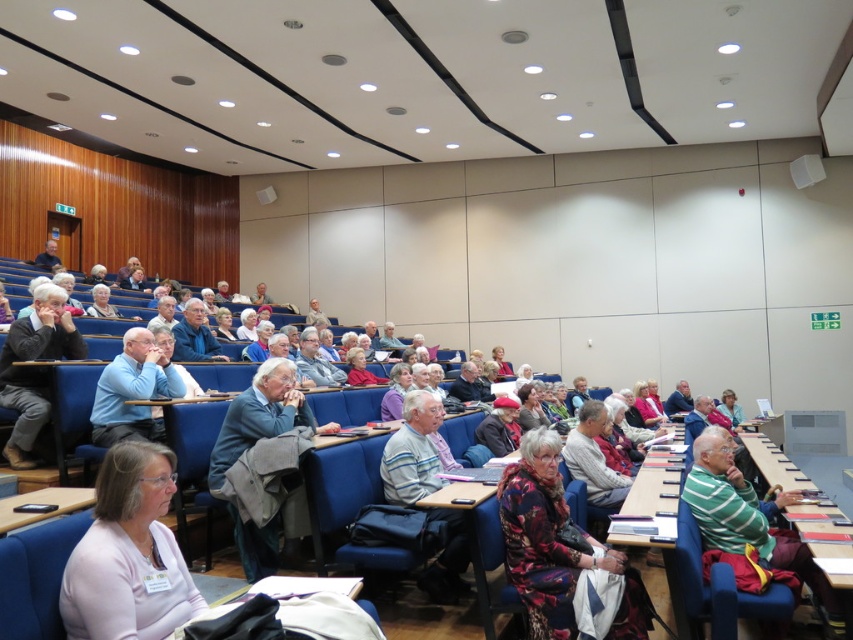
Image resolution: width=853 pixels, height=640 pixels. What do you see at coordinates (194, 337) in the screenshot?
I see `gray fabric jacket at center` at bounding box center [194, 337].

Between gray fabric jacket at center and matte black jacket at center, which one has more height?

With more height is gray fabric jacket at center.

Where is `gray fabric jacket at center`? Image resolution: width=853 pixels, height=640 pixels. gray fabric jacket at center is located at coordinates (194, 337).

Does floral fabric dress at center appear under matte black jacket at center?

Yes.

Between floral fabric dress at center and matte black jacket at center, which one is positioned lower?

Positioned lower is floral fabric dress at center.

This screenshot has height=640, width=853. Find the location of `floral fabric dress at center`. floral fabric dress at center is located at coordinates (556, 547).

Where is `floral fabric dress at center`? floral fabric dress at center is located at coordinates (556, 547).

Can you confirm if pink fabric shirt at lower left is positioned above floral fabric dress at center?

Correct, pink fabric shirt at lower left is located above floral fabric dress at center.

Between pink fabric shirt at lower left and floral fabric dress at center, which one is positioned lower?

floral fabric dress at center is below.

Does point (128, 604) come in front of point (519, 564)?

Yes.

Where is `pink fabric shirt at lower left`? pink fabric shirt at lower left is located at coordinates (128, 554).